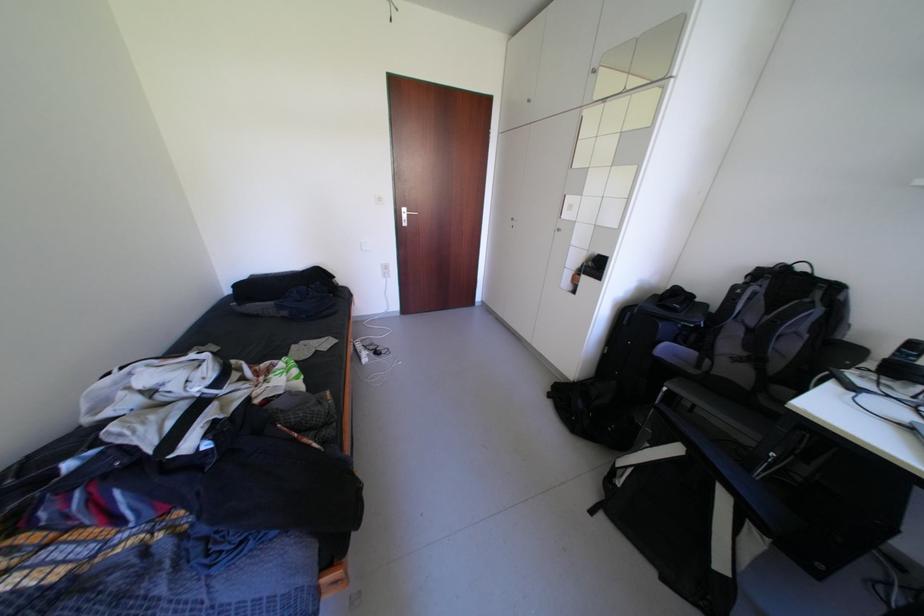
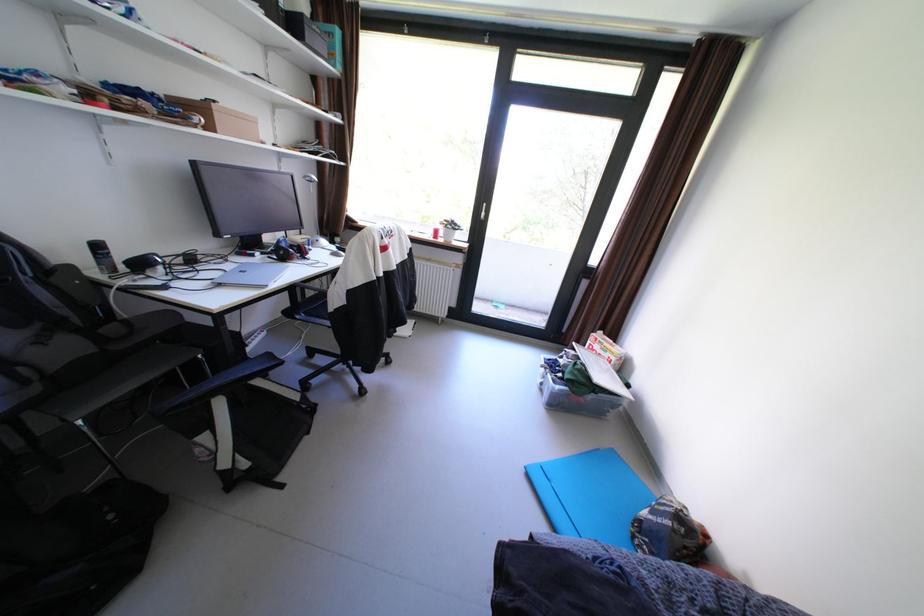
Locate, in the second image, the point that corresponds to pixel 784 455 in the first image.

(210, 357)